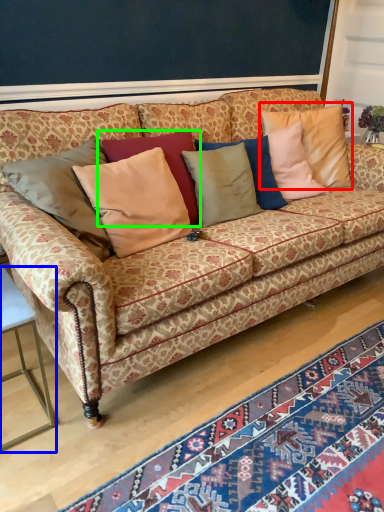
Question: Based on their relative distances, which object is farther from pillow (highlighted by a red box)? Choose from table (highlighted by a blue box) and pillow (highlighted by a green box).

Choices:
 (A) table
 (B) pillow

Answer: (A)